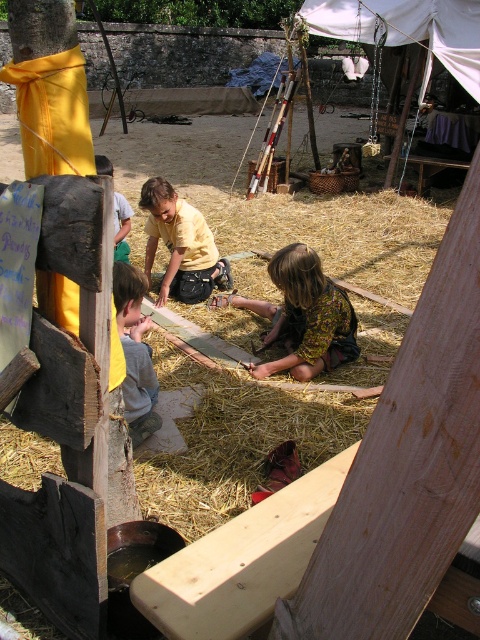
Question: Does white fabric canopy at upper center appear over gray fabric shirt at lower left?

Choices:
 (A) yes
 (B) no

Answer: (A)

Question: Estimate the real-world distances between objects in this image. Which object is closer to the yellow matte shirt at center?

Choices:
 (A) white fabric canopy at upper center
 (B) light blue t-shirt at lower left
 (C) gray fabric shirt at lower left

Answer: (B)

Question: Does printed fabric dress at center lie behind yellow matte shirt at center?

Choices:
 (A) no
 (B) yes

Answer: (A)

Question: Which point is closer to the camera?

Choices:
 (A) pyautogui.click(x=419, y=28)
 (B) pyautogui.click(x=115, y=208)

Answer: (B)

Question: Is yellow matte shirt at center below gray fabric shirt at lower left?

Choices:
 (A) no
 (B) yes

Answer: (A)

Question: Which point is closer to the camera taking this photo?

Choices:
 (A) (361, 33)
 (B) (99, 170)

Answer: (B)